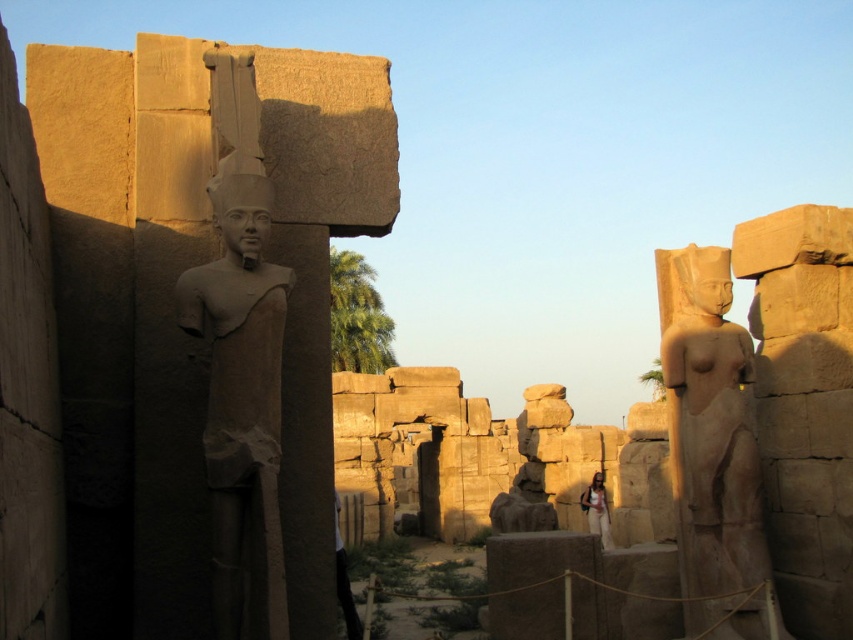
Between gray stone statue at left and light brown stone statue at center, which one appears on the right side from the viewer's perspective?

Positioned to the right is light brown stone statue at center.

Based on the photo, which is above, gray stone statue at left or light brown stone statue at center?

Positioned higher is gray stone statue at left.

Image resolution: width=853 pixels, height=640 pixels. What do you see at coordinates (242, 397) in the screenshot?
I see `gray stone statue at left` at bounding box center [242, 397].

Identify the location of gray stone statue at left. (242, 397).

Who is higher up, smooth beige statue at right or light brown stone statue at center?

smooth beige statue at right is higher up.

The image size is (853, 640). What are the coordinates of `smooth beige statue at right` in the screenshot? It's located at (711, 444).

Identify the location of smooth beige statue at right. Image resolution: width=853 pixels, height=640 pixels. (711, 444).

Is gray stone statue at left below smooth beige statue at right?

Actually, gray stone statue at left is above smooth beige statue at right.

Consider the image. Between gray stone statue at left and smooth beige statue at right, which one appears on the right side from the viewer's perspective?

smooth beige statue at right is more to the right.

Describe the element at coordinates (242, 397) in the screenshot. Image resolution: width=853 pixels, height=640 pixels. I see `gray stone statue at left` at that location.

This screenshot has height=640, width=853. Find the location of `gray stone statue at left`. gray stone statue at left is located at coordinates (242, 397).